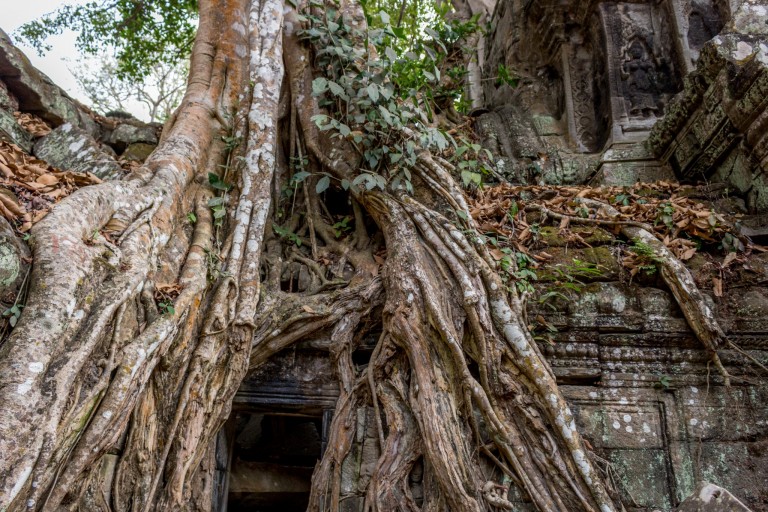
The image size is (768, 512). I want to click on carved detailing, so click(x=584, y=98).